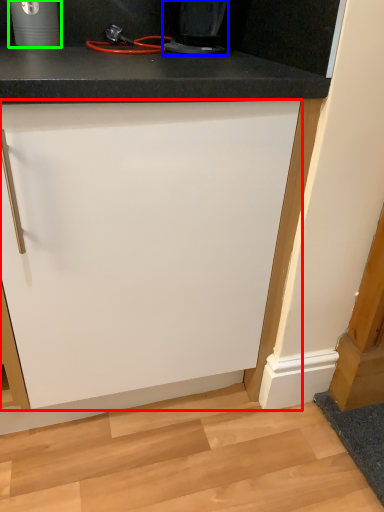
Question: Considering the real-world distances, which object is closest to cabinetry (highlighted by a red box)? home appliance (highlighted by a blue box) or appliance (highlighted by a green box).

Choices:
 (A) home appliance
 (B) appliance

Answer: (A)